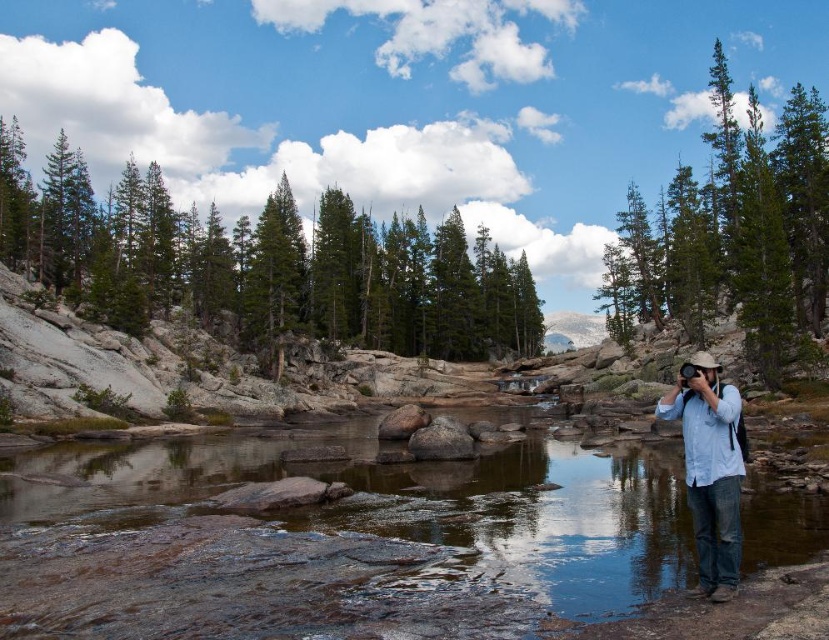
Question: Can you confirm if clear water at center is positioned below light blue denim shirt at center-right?

Choices:
 (A) yes
 (B) no

Answer: (A)

Question: Is green matte tree at upper right wider than light blue denim shirt at center-right?

Choices:
 (A) yes
 (B) no

Answer: (A)

Question: Which of these objects is positioned closest to the green matte tree at upper right?

Choices:
 (A) light blue denim shirt at center-right
 (B) green textured trees at upper center

Answer: (A)

Question: Which of these objects is positioned farthest from the green matte tree at upper right?

Choices:
 (A) green textured trees at upper center
 (B) light blue denim shirt at center-right

Answer: (A)

Question: Does clear water at center come behind light blue denim shirt at center-right?

Choices:
 (A) no
 (B) yes

Answer: (A)

Question: Which point appears farthest from the camera in this image?

Choices:
 (A) (507, 451)
 (B) (668, 202)

Answer: (B)